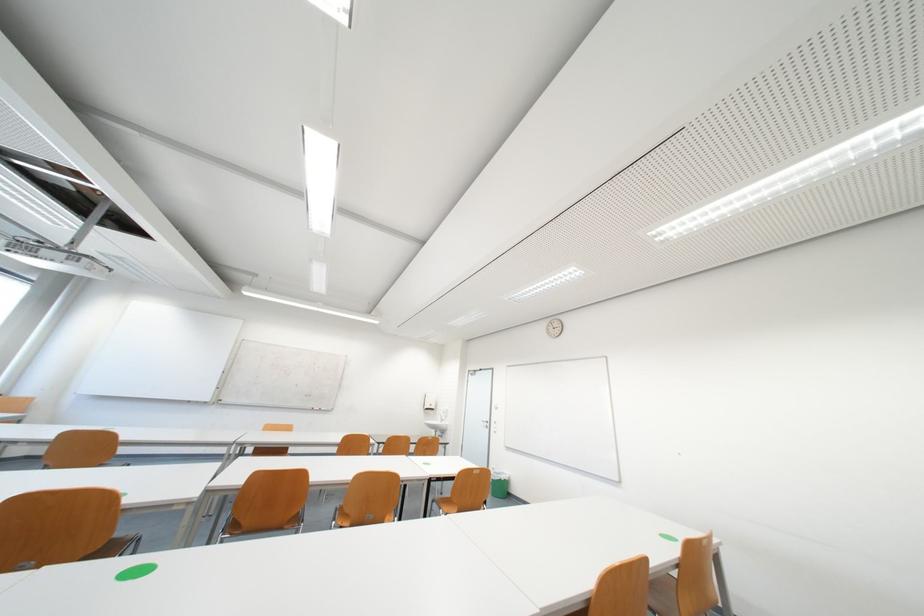
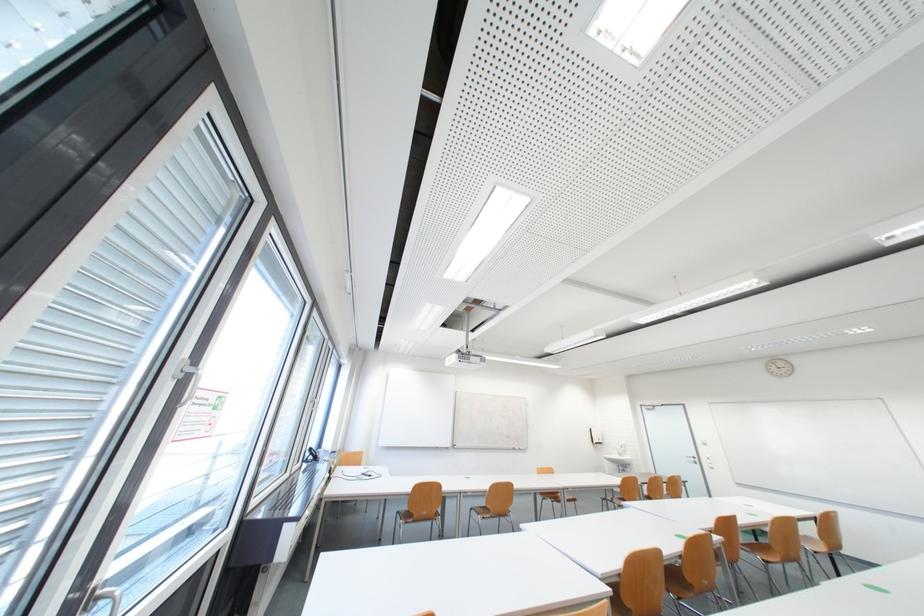
Question: What movement of the cameraman would produce the second image?

Choices:
 (A) Left
 (B) Right
 (C) Forward
 (D) Backward

Answer: (A)